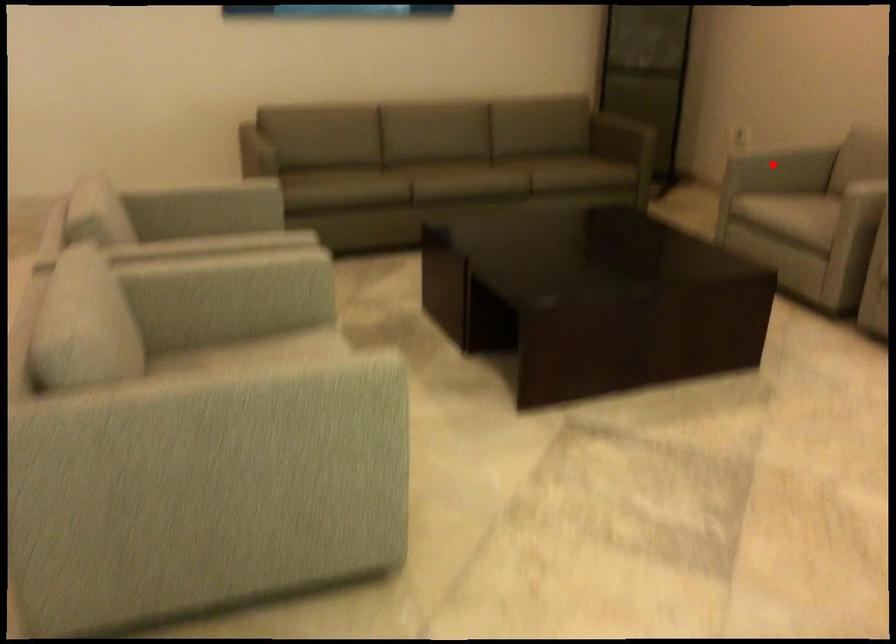
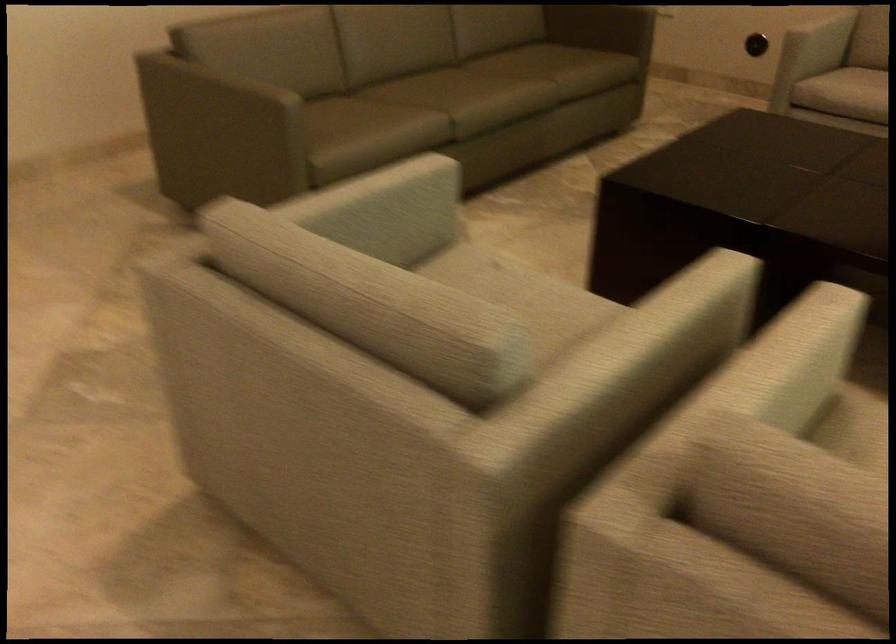
Question: I am providing you with two images of the same scene from different viewpoints. Image1 has a red point marked. In image2, the corresponding 3D location appears at what relative position? Reply with the corresponding letter.

Choices:
 (A) Closer
 (B) Farther

Answer: (A)